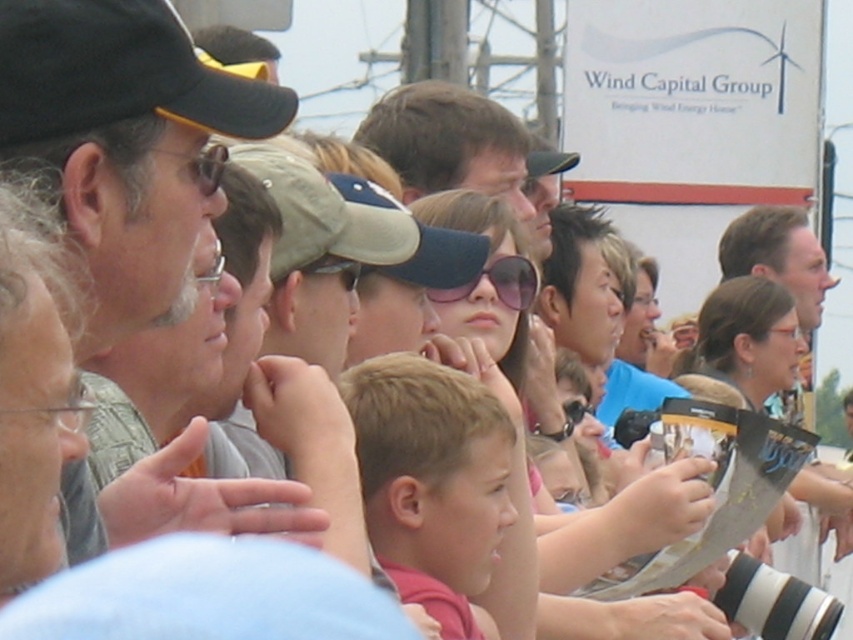
Can you confirm if blonde hair at center is positioned to the left of pink reflective sunglasses at center?

Indeed, blonde hair at center is positioned on the left side of pink reflective sunglasses at center.

Is blonde hair at center bigger than pink reflective sunglasses at center?

Yes, blonde hair at center is bigger than pink reflective sunglasses at center.

This screenshot has height=640, width=853. What are the coordinates of `blonde hair at center` in the screenshot? It's located at (431, 476).

Which is above, matte black cap at left or blonde hair at center?

matte black cap at left is above.

Between point (149, 80) and point (511, 429), which one is positioned in front?

Point (149, 80) is in front.

This screenshot has width=853, height=640. I want to click on matte black cap at left, so click(x=123, y=141).

The height and width of the screenshot is (640, 853). Find the location of `matte black cap at left`. matte black cap at left is located at coordinates (123, 141).

Does matte black cap at left have a lesser height compared to light brown cap at center?

Incorrect, matte black cap at left's height does not fall short of light brown cap at center's.

Does matte black cap at left have a greater height compared to light brown cap at center?

Correct, matte black cap at left is much taller as light brown cap at center.

Find the location of a particular element. matte black cap at left is located at coordinates (123, 141).